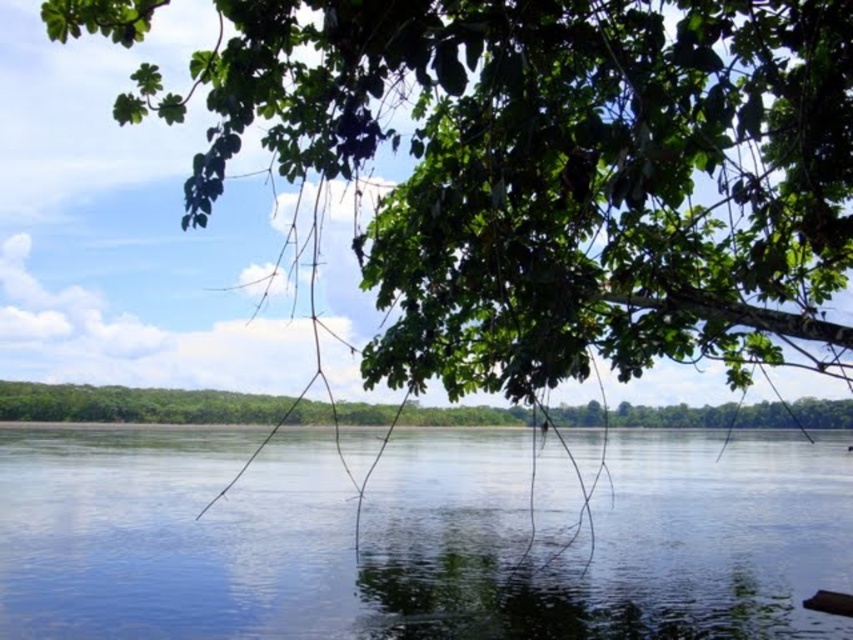
Which of these two, transparent water at center or green leafy tree at center, stands shorter?

green leafy tree at center

From the picture: Can you confirm if transparent water at center is bigger than green leafy tree at center?

Yes, transparent water at center is bigger than green leafy tree at center.

Where is `transparent water at center`? transparent water at center is located at coordinates point(408,536).

This screenshot has width=853, height=640. Identify the location of transparent water at center. (408, 536).

How much distance is there between green leafy tree at upper center and green leafy tree at center?

green leafy tree at upper center and green leafy tree at center are 3.18 meters apart from each other.

Is point (714, 339) closer to camera compared to point (585, 404)?

Yes, point (714, 339) is in front of point (585, 404).

Between point (370, 262) and point (660, 406), which one is positioned in front?

Point (370, 262) is more forward.

This screenshot has width=853, height=640. Identify the location of green leafy tree at upper center. (555, 170).

Does green leafy tree at upper center appear under transparent water at center?

No, green leafy tree at upper center is not below transparent water at center.

Is green leafy tree at upper center smaller than transparent water at center?

Incorrect, green leafy tree at upper center is not smaller in size than transparent water at center.

Is point (451, 314) closer to camera compared to point (802, 461)?

Yes, it is in front of point (802, 461).

The width and height of the screenshot is (853, 640). In order to click on green leafy tree at upper center in this screenshot , I will do `click(555, 170)`.